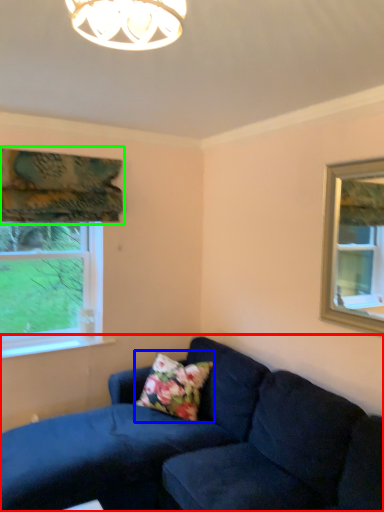
Question: Considering the real-world distances, which object is closest to studio couch (highlighted by a red box)? pillow (highlighted by a blue box) or curtain (highlighted by a green box).

Choices:
 (A) pillow
 (B) curtain

Answer: (A)